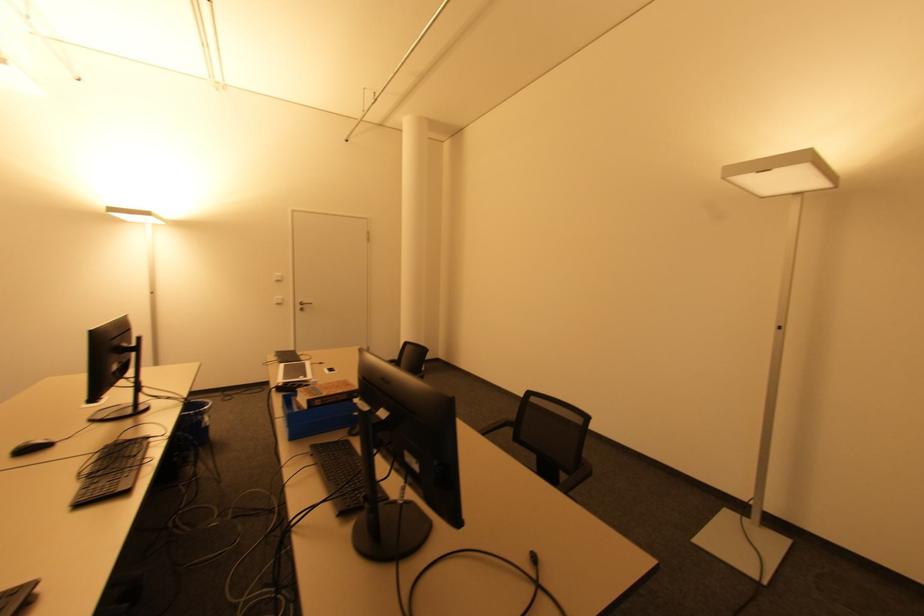
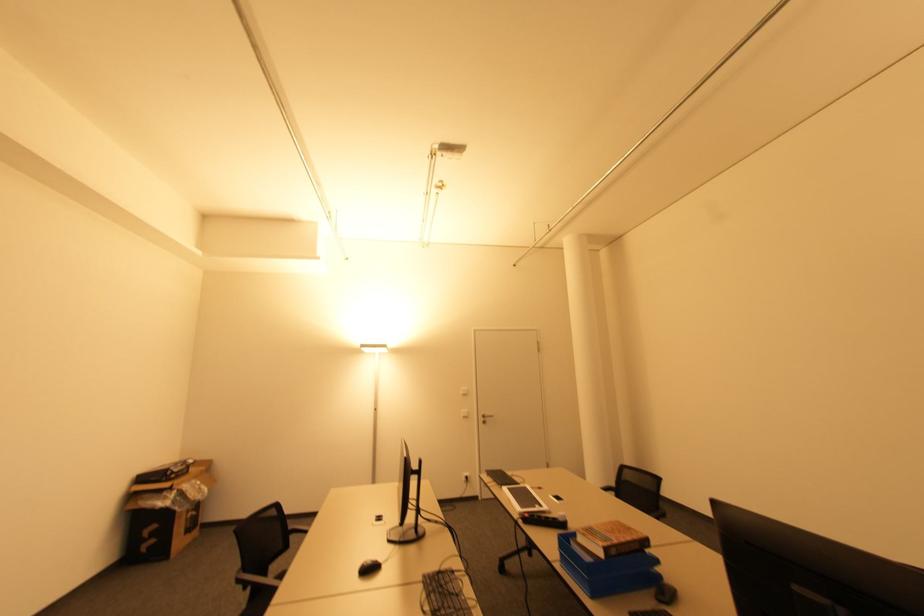
The point at (280,304) is marked in the first image. Where is the corresponding point in the second image?

(467, 416)